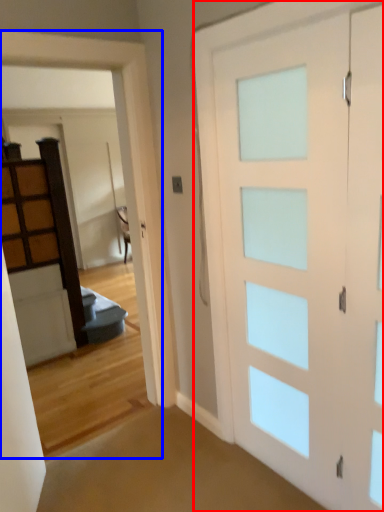
Question: Which object is further to the camera taking this photo, barn door (highlighted by a red box) or garage door (highlighted by a blue box)?

Choices:
 (A) barn door
 (B) garage door

Answer: (B)